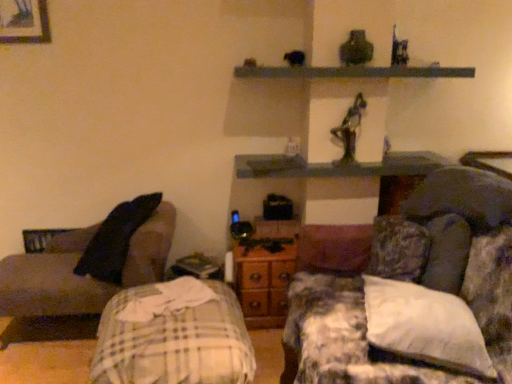
Question: Considering the positions of point (66, 266) and point (261, 160), is point (66, 266) closer or farther from the camera than point (261, 160)?

Choices:
 (A) closer
 (B) farther

Answer: (A)

Question: From the image's perspective, is dark gray fabric couch at left, which is counted as the 2th studio couch, starting from the right, above or below wooden shelf at center, acting as the 1th shelf starting from the bottom?

Choices:
 (A) below
 (B) above

Answer: (A)

Question: Which object is positioned closest to the fluffy fabric couch at right, arranged as the 2th studio couch when viewed from the left?

Choices:
 (A) dark gray fabric couch at left, the 1th studio couch viewed from the left
 (B) smooth gray shelf at upper center, the 1th shelf positioned from the top
 (C) wooden framed picture at upper left
 (D) plaid fabric bed at lower left
 (E) white soft pillow at right

Answer: (E)

Question: Estimate the real-world distances between objects in this image. Which object is farther from the wooden shelf at center, acting as the 1th shelf starting from the bottom?

Choices:
 (A) fluffy fabric couch at right, arranged as the 1th studio couch when viewed from the right
 (B) plaid fabric bed at lower left
 (C) white soft pillow at right
 (D) wooden framed picture at upper left
 (E) dark gray fabric couch at left, the 1th studio couch viewed from the left

Answer: (D)